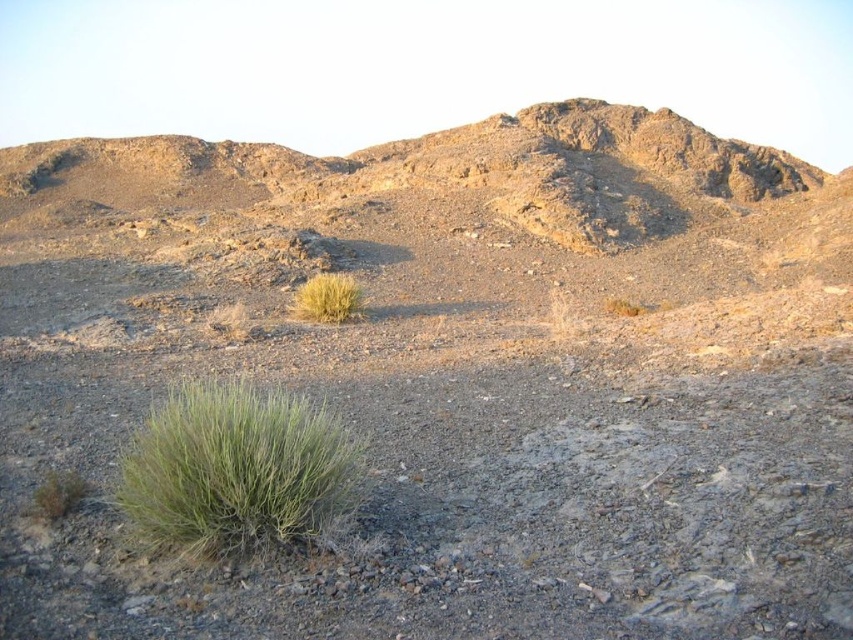
Does green leafy bush at lower left have a larger size compared to green fuzzy bush at lower left?

Indeed, green leafy bush at lower left has a larger size compared to green fuzzy bush at lower left.

Does green leafy bush at lower left have a greater height compared to green fuzzy bush at lower left?

Yes.

Is point (161, 477) positioned after point (57, 497)?

No.

Find the location of a particular element. Image resolution: width=853 pixels, height=640 pixels. green leafy bush at lower left is located at coordinates (236, 468).

This screenshot has width=853, height=640. Describe the element at coordinates (236, 468) in the screenshot. I see `green leafy bush at lower left` at that location.

Does green leafy bush at lower left have a lesser height compared to dry grass at center?

Incorrect, green leafy bush at lower left's height does not fall short of dry grass at center's.

Between point (155, 440) and point (312, 304), which one is positioned in front?

Point (155, 440)

At what (x,y) coordinates should I click in order to perform the action: click on green leafy bush at lower left. Please return your answer as a coordinate pair (x, y). The image size is (853, 640). Looking at the image, I should click on (236, 468).

Between dry grass at center and green fuzzy bush at lower left, which one is positioned higher?

dry grass at center

Is point (363, 298) behind point (59, 516)?

Yes, point (363, 298) is behind point (59, 516).

At what (x,y) coordinates should I click in order to perform the action: click on dry grass at center. Please return your answer as a coordinate pair (x, y). The height and width of the screenshot is (640, 853). Looking at the image, I should click on (328, 298).

The height and width of the screenshot is (640, 853). In order to click on dry grass at center in this screenshot , I will do `click(328, 298)`.